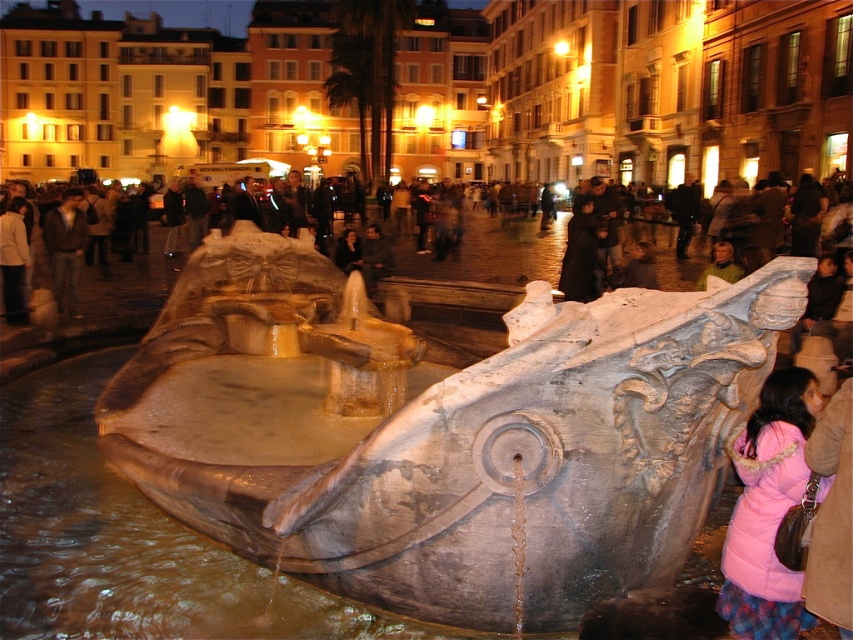
You are a photographer trying to capture both the pink puffy coat at lower right and the pink fabric coat at lower right in the same frame. Which one should you adjust your camera angle to focus on first to ensure both are in the shot?

The pink puffy coat at lower right is positioned on the right side of the pink fabric coat at lower right, so you should focus on the pink fabric coat at lower right first to ensure both are in the frame.